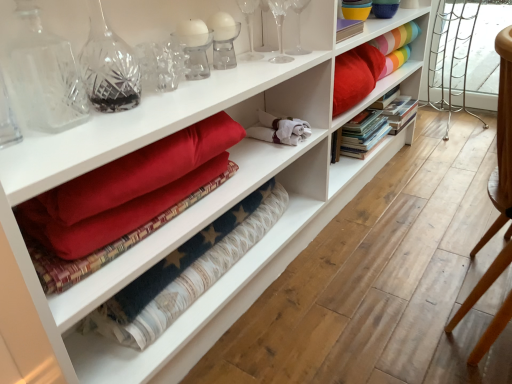
Question: Can you confirm if clear crystal glass at upper center, marked as the 2th glass vase in a front-to-back arrangement, is shorter than white cotton towels at center?

Choices:
 (A) yes
 (B) no

Answer: (B)

Question: Is clear crystal glass at upper center, which appears as the second glass vase when viewed from the left, positioned with its back to white cotton towels at center?

Choices:
 (A) no
 (B) yes

Answer: (A)

Question: Is clear crystal glass at upper center, marked as the 2th glass vase in a front-to-back arrangement, smaller than white cotton towels at center?

Choices:
 (A) yes
 (B) no

Answer: (A)

Question: Is white cotton towels at center surrounded by clear crystal glass at upper center, which is the second glass vase in back-to-front order?

Choices:
 (A) no
 (B) yes

Answer: (A)

Question: From a real-world perspective, is clear crystal glass at upper center, which appears as the second glass vase when viewed from the left, over white cotton towels at center?

Choices:
 (A) no
 (B) yes

Answer: (B)

Question: Considering the positions of rainbow striped fabric at upper right and white cotton towels at center in the image, is rainbow striped fabric at upper right wider or thinner than white cotton towels at center?

Choices:
 (A) thin
 (B) wide

Answer: (A)

Question: In terms of size, does rainbow striped fabric at upper right appear bigger or smaller than white cotton towels at center?

Choices:
 (A) small
 (B) big

Answer: (B)

Question: Would you say rainbow striped fabric at upper right is to the left or to the right of white cotton towels at center in the picture?

Choices:
 (A) left
 (B) right

Answer: (B)

Question: Considering the positions of point (416, 28) and point (276, 122), is point (416, 28) closer or farther from the camera than point (276, 122)?

Choices:
 (A) closer
 (B) farther

Answer: (B)

Question: From a real-world perspective, is rainbow striped fabric at upper right physically located above or below hardcover books at center?

Choices:
 (A) below
 (B) above

Answer: (B)

Question: Is rainbow striped fabric at upper right wider or thinner than hardcover books at center?

Choices:
 (A) thin
 (B) wide

Answer: (A)

Question: Is rainbow striped fabric at upper right bigger or smaller than hardcover books at center?

Choices:
 (A) big
 (B) small

Answer: (B)

Question: Considering the relative positions of rainbow striped fabric at upper right and hardcover books at center in the image provided, is rainbow striped fabric at upper right to the left or to the right of hardcover books at center?

Choices:
 (A) right
 (B) left

Answer: (A)

Question: Considering the positions of point (300, 46) and point (360, 137), is point (300, 46) closer or farther from the camera than point (360, 137)?

Choices:
 (A) closer
 (B) farther

Answer: (A)

Question: Based on their sizes in the image, would you say transparent glass wine glass at upper center, the first glass vase in the back-to-front sequence, is bigger or smaller than hardcover books at center?

Choices:
 (A) small
 (B) big

Answer: (A)